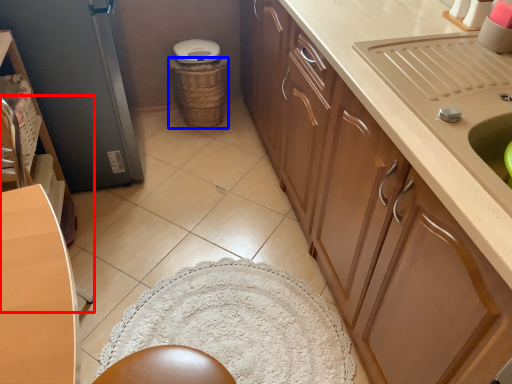
Question: Among these objects, which one is farthest to the camera, chair (highlighted by a red box) or basket (highlighted by a blue box)?

Choices:
 (A) chair
 (B) basket

Answer: (B)